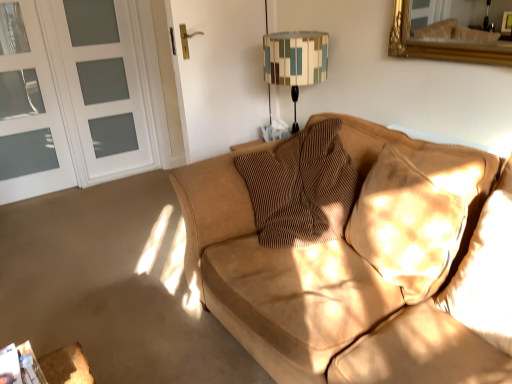
You are a GUI agent. You are given a task and a screenshot of the screen. Output one action in this format:
    pyautogui.click(x=<x>, y=<y>)
    Task: Click on the free spot below white frosted glass screen door at left, which ranks as the first screen door in right-to-left order (from a real-world perspective)
    The height and width of the screenshot is (384, 512).
    Given the screenshot: What is the action you would take?
    pyautogui.click(x=125, y=170)